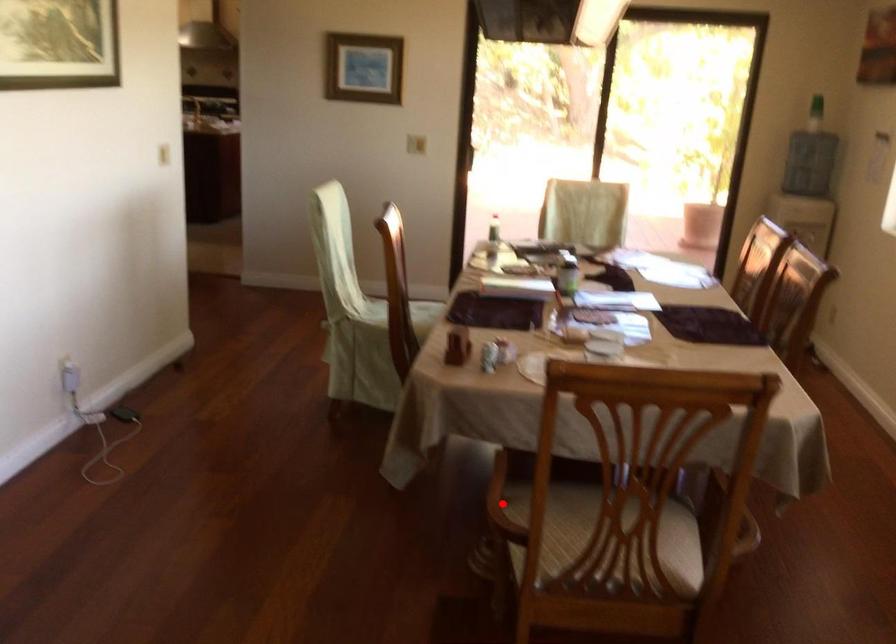
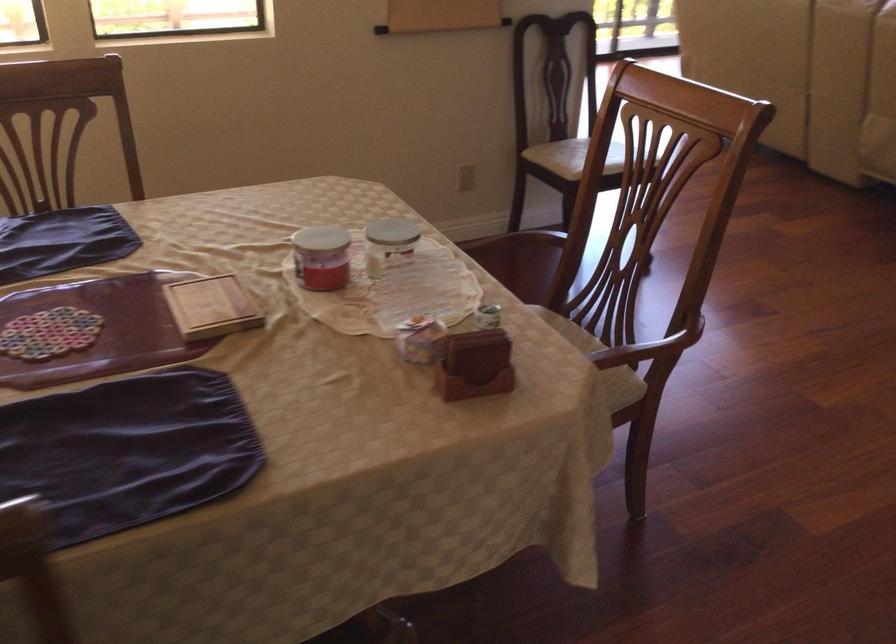
Question: I am providing you with two images of the same scene from different viewpoints. A red point is marked on the first image. At the location where the point appears in image 1, is it still visible in image 2?

Choices:
 (A) Yes
 (B) No

Answer: (B)